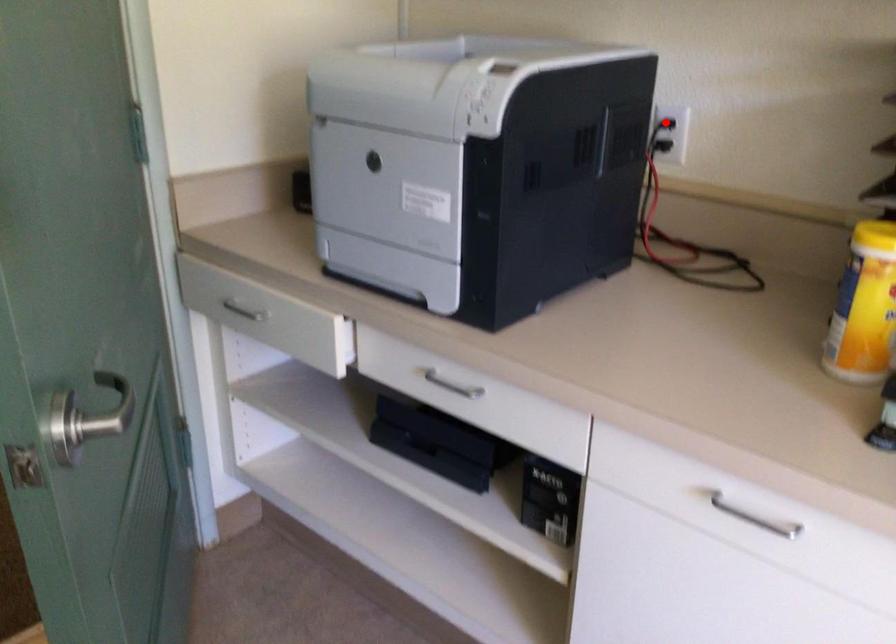
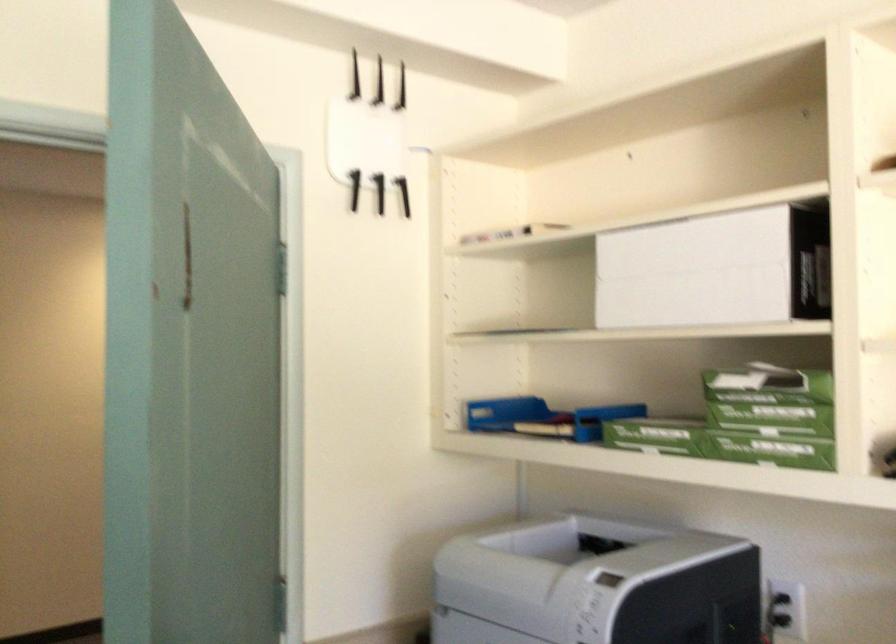
Find the pixel in the second image that matches the highlighted location in the first image.

(782, 609)